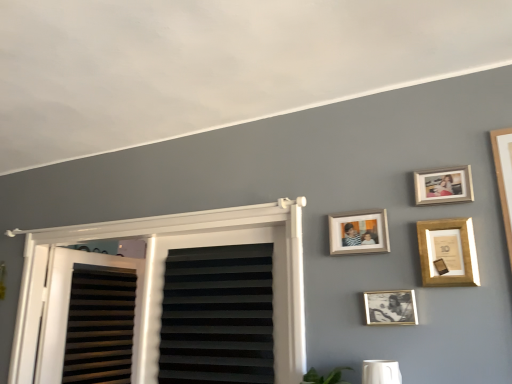
Question: Is white plastic window at upper left to the right of wooden picture frame at upper right, which is counted as the 2th picture frame, starting from the bottom, from the viewer's perspective?

Choices:
 (A) no
 (B) yes

Answer: (A)

Question: Does white plastic window at upper left have a smaller size compared to wooden picture frame at upper right, which is counted as the 2th picture frame, starting from the bottom?

Choices:
 (A) yes
 (B) no

Answer: (B)

Question: Is white plastic window at upper left positioned with its back to wooden picture frame at upper right, which is counted as the 2th picture frame, starting from the bottom?

Choices:
 (A) yes
 (B) no

Answer: (B)

Question: Is the position of white plastic window at upper left less distant than that of wooden picture frame at upper right, the third picture frame from the top?

Choices:
 (A) yes
 (B) no

Answer: (B)

Question: From the image's perspective, does white plastic window at upper left appear lower than wooden picture frame at upper right, which is counted as the 2th picture frame, starting from the bottom?

Choices:
 (A) yes
 (B) no

Answer: (A)

Question: Is wooden picture frame at upper right, the third picture frame from the top, inside white plastic window at upper left?

Choices:
 (A) no
 (B) yes

Answer: (A)

Question: Is white plastic window at upper left to the left of wooden photo frame at upper center, the 3th picture frame in the bottom-to-top sequence, from the viewer's perspective?

Choices:
 (A) yes
 (B) no

Answer: (A)

Question: Can you confirm if white plastic window at upper left is wider than wooden photo frame at upper center, the 3th picture frame in the bottom-to-top sequence?

Choices:
 (A) yes
 (B) no

Answer: (A)

Question: Can you confirm if white plastic window at upper left is smaller than wooden photo frame at upper center, the 2th picture frame from the top?

Choices:
 (A) yes
 (B) no

Answer: (B)

Question: Does white plastic window at upper left have a greater height compared to wooden photo frame at upper center, the 3th picture frame in the bottom-to-top sequence?

Choices:
 (A) yes
 (B) no

Answer: (A)

Question: From a real-world perspective, is white plastic window at upper left positioned over wooden photo frame at upper center, the 3th picture frame in the bottom-to-top sequence, based on gravity?

Choices:
 (A) yes
 (B) no

Answer: (B)

Question: From a real-world perspective, is white plastic window at upper left below wooden photo frame at upper center, the 3th picture frame in the bottom-to-top sequence?

Choices:
 (A) no
 (B) yes

Answer: (B)

Question: Can you confirm if black/gold photo frame at center, the first picture frame positioned from the bottom, is smaller than wooden photo frame at upper right, the fourth picture frame positioned from the bottom?

Choices:
 (A) no
 (B) yes

Answer: (B)